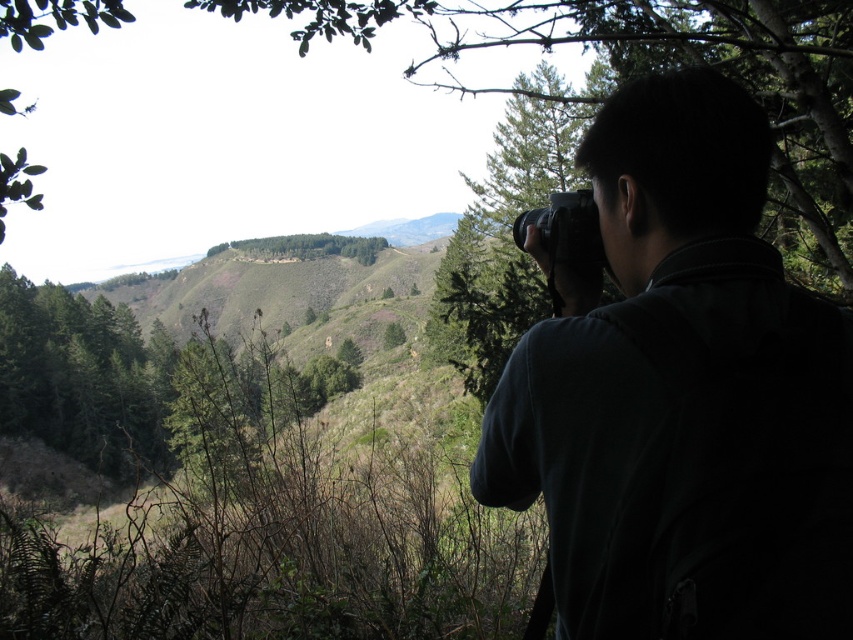
Consider the image. Can you confirm if black plastic camera at upper right is shorter than green leafy trees at center?

Indeed, black plastic camera at upper right has a lesser height compared to green leafy trees at center.

This screenshot has height=640, width=853. What do you see at coordinates (566, 228) in the screenshot?
I see `black plastic camera at upper right` at bounding box center [566, 228].

The image size is (853, 640). Find the location of `black plastic camera at upper right`. black plastic camera at upper right is located at coordinates (566, 228).

Can you confirm if dark fabric camera at right is taller than green leafy trees at center?

No, dark fabric camera at right is not taller than green leafy trees at center.

Which is more to the left, dark fabric camera at right or green leafy trees at center?

Positioned to the left is green leafy trees at center.

The width and height of the screenshot is (853, 640). What do you see at coordinates (682, 396) in the screenshot?
I see `dark fabric camera at right` at bounding box center [682, 396].

This screenshot has width=853, height=640. Find the location of `dark fabric camera at right`. dark fabric camera at right is located at coordinates (682, 396).

Between dark fabric camera at right and black plastic camera at upper right, which one appears on the right side from the viewer's perspective?

Positioned to the right is black plastic camera at upper right.

From the picture: Which is more to the left, dark fabric camera at right or black plastic camera at upper right?

dark fabric camera at right is more to the left.

Is point (778, 472) positioned after point (590, 257)?

No, it is in front of (590, 257).

Where is `dark fabric camera at right`? dark fabric camera at right is located at coordinates (682, 396).